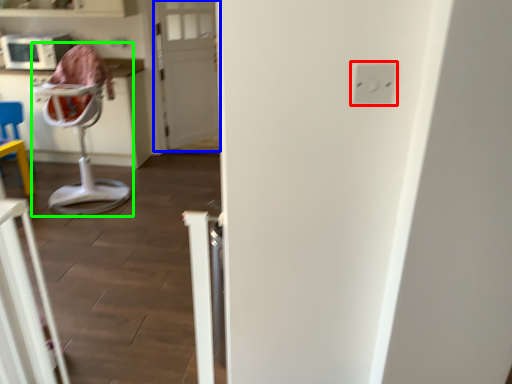
Question: Considering the real-world distances, which object is closest to electric outlet (highlighted by a red box)? door (highlighted by a blue box) or feeding chair (highlighted by a green box).

Choices:
 (A) door
 (B) feeding chair

Answer: (B)